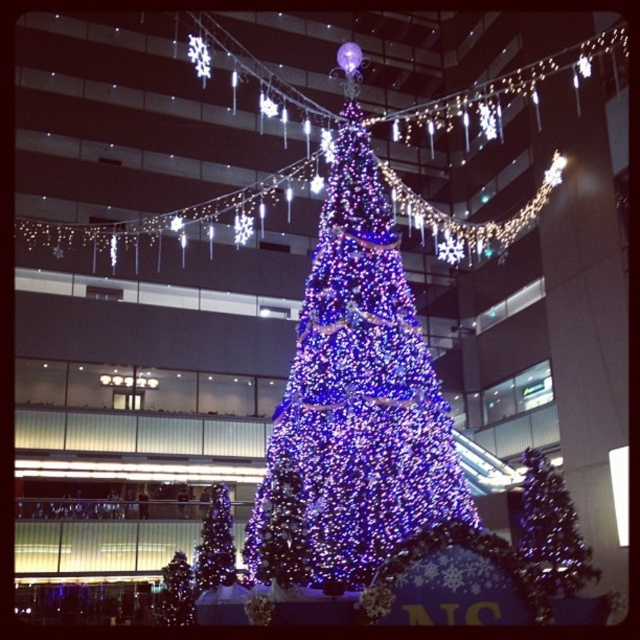
You are standing in the festive scene and want to take a photo of the iridescent blue lights at center and the iridescent glass christmas tree at center. Which object will appear larger in your photo?

The iridescent blue lights at center will appear larger in the photo because they are closer to the viewer than the iridescent glass christmas tree at center.

You are standing in front of the festive scene with the iridescent blue lights at center and the iridescent glass christmas tree at center. Which object is positioned to the left?

The iridescent blue lights at center are positioned to the left of the iridescent glass christmas tree at center.

You are a drone operator tasked with capturing aerial footage of the festive scene. Your drone has a maximum flight range of 30 meters from its starting position. If you position the drone directly above the iridescent glass christmas tree at lower left, will you be able to fly the drone to the iridescent glass christmas tree at center without exceeding its range?

A: The distance between the iridescent glass christmas tree at center and the iridescent glass christmas tree at lower left is 29.76 meters. Since the drone has a maximum range of 30 meters, it can reach the iridescent glass christmas tree at center from the starting position above the iridescent glass christmas tree at lower left.